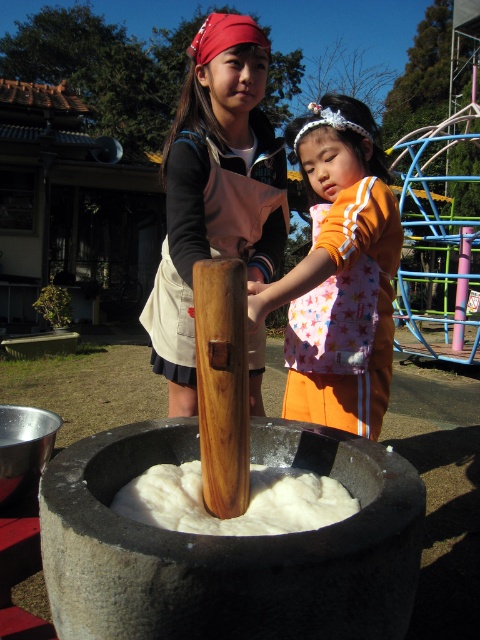
Does wooden rolling pin at center appear on the right side of metallic silver basin at lower left?

Indeed, wooden rolling pin at center is positioned on the right side of metallic silver basin at lower left.

Does wooden rolling pin at center have a lesser height compared to metallic silver basin at lower left?

No.

Which is in front, point (206, 378) or point (23, 413)?

Point (206, 378) is more forward.

Find the location of a particular element. wooden rolling pin at center is located at coordinates (223, 384).

Between orange fabric dress at center and metallic silver basin at lower left, which one has more height?

With more height is orange fabric dress at center.

Does orange fabric dress at center come behind metallic silver basin at lower left?

No, it is not.

Who is more forward, (300,312) or (6,456)?

Point (6,456) is in front.

Identify the location of orange fabric dress at center. (339, 276).

Is wooden rolling pin at center wider than white fluffy flour at center?

In fact, wooden rolling pin at center might be narrower than white fluffy flour at center.

Is wooden rolling pin at center further to camera compared to white fluffy flour at center?

Yes, it is.

At what (x,y) coordinates should I click in order to perform the action: click on wooden rolling pin at center. Please return your answer as a coordinate pair (x, y). The width and height of the screenshot is (480, 640). Looking at the image, I should click on (223, 384).

Locate an element on the screen. wooden rolling pin at center is located at coordinates (223, 384).